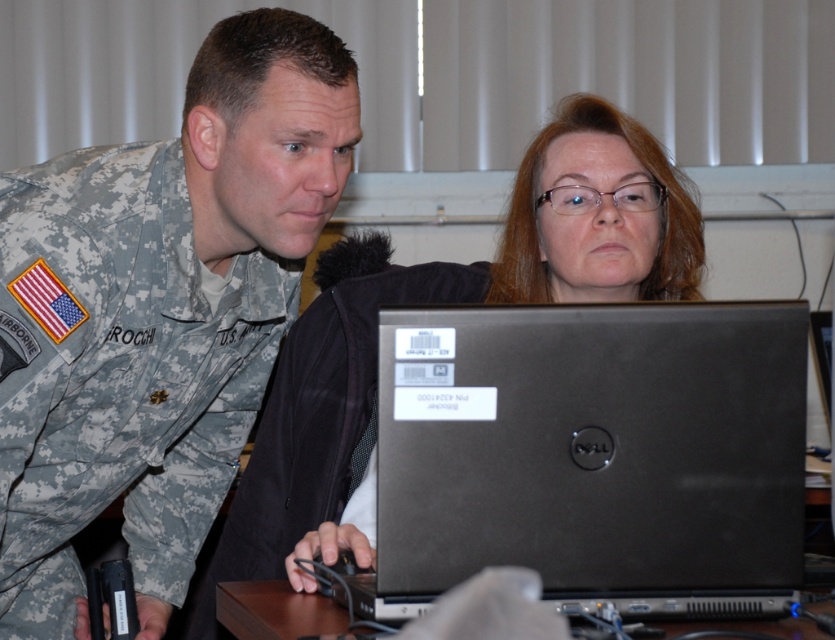
You are a photographer trying to capture both the camouflage uniform at left and the black matte laptop at center in a single frame. Given their sizes, which object should you focus on to ensure both are clearly visible without zooming in or out?

The camouflage uniform at left is larger than the black matte laptop at center, so you should focus on the camouflage uniform at left to ensure both are clearly visible without adjusting the zoom.

You are a photographer setting up for a group photo. You need to ensure that both the black matte laptop at center and the brown wooden table at lower center are in focus. Which object should you focus on first to ensure both are sharp in the final image?

The black matte laptop at center is positioned over brown wooden table at lower center, so you should focus on the brown wooden table at lower center first to ensure both are in focus.